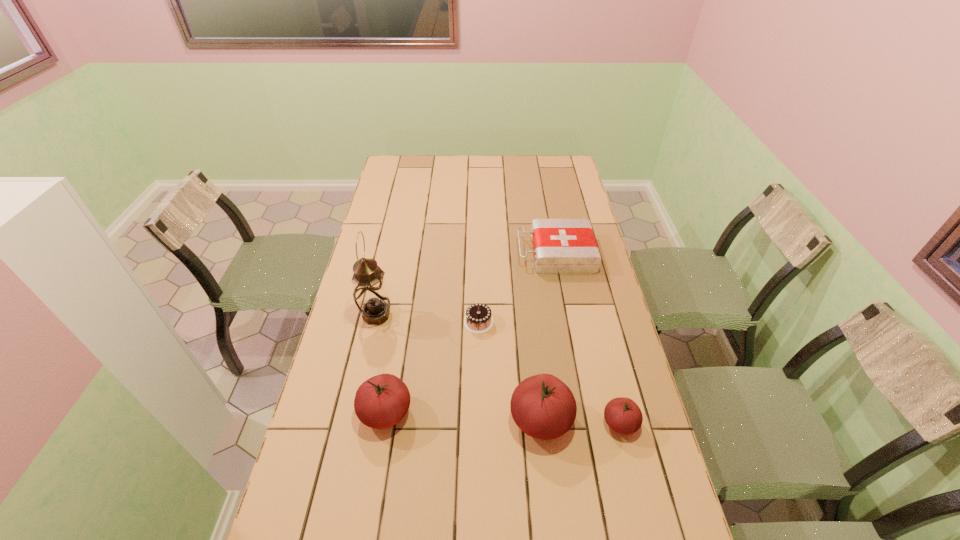
Identify the location of vacant space located 0.350m on the front side of the farthest object. (427, 253).

You are a GUI agent. You are given a task and a screenshot of the screen. Output one action in this format:
    pyautogui.click(x=<x>, y=<y>)
    Task: Click on the vacant region located on the front side of the farthest object
    Image resolution: width=960 pixels, height=540 pixels.
    Given the screenshot: What is the action you would take?
    pyautogui.click(x=464, y=253)

The image size is (960, 540). Identify the location of vacant space situated 0.090m on the front side of the farthest object. (494, 253).

What are the coordinates of `vacant space located 0.320m on the back of the third object from left to right` in the screenshot? It's located at (479, 249).

Identify the location of free spot located on the back of the tallest object. Image resolution: width=960 pixels, height=540 pixels. (393, 240).

Locate an element on the screen. This screenshot has width=960, height=540. tomato present at the left edge is located at coordinates (382, 401).

Image resolution: width=960 pixels, height=540 pixels. In order to click on oil lamp at the left edge in this screenshot , I will do `click(370, 293)`.

What are the coordinates of `tomato present at the right edge` in the screenshot? It's located at (623, 415).

Locate an element on the screen. Image resolution: width=960 pixels, height=540 pixels. the first-aid kit present at the right edge is located at coordinates (561, 246).

This screenshot has width=960, height=540. In order to click on vacant area at the far edge of the desktop in this screenshot , I will do `click(507, 178)`.